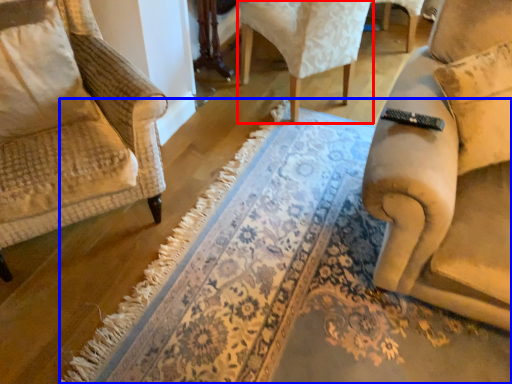
Question: Which object is further to the camera taking this photo, chair (highlighted by a red box) or doormat (highlighted by a blue box)?

Choices:
 (A) chair
 (B) doormat

Answer: (A)